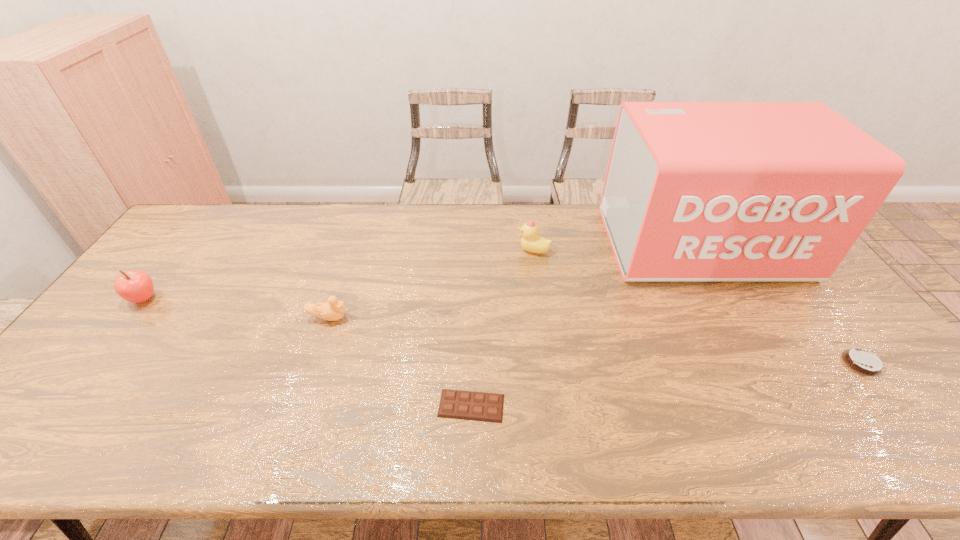
Locate an element on the screen. Image resolution: width=960 pixels, height=540 pixels. free space at the far left corner of the desktop is located at coordinates (196, 227).

The height and width of the screenshot is (540, 960). Identify the location of free space between the right duckling and the fourth nearest object. (339, 275).

Where is `free area in between the third object from left to right and the farther duckling`? This screenshot has height=540, width=960. free area in between the third object from left to right and the farther duckling is located at coordinates (502, 328).

This screenshot has height=540, width=960. I want to click on free spot between the box and the nearest object, so click(586, 325).

Image resolution: width=960 pixels, height=540 pixels. Identify the location of unoccupied position between the fourth nearest object and the chocolate cake. (503, 331).

Find the location of `free space that is in between the tallest object and the shortest object`. free space that is in between the tallest object and the shortest object is located at coordinates (586, 325).

The width and height of the screenshot is (960, 540). I want to click on empty location between the shortest object and the left duckling, so click(399, 362).

You are a GUI agent. You are given a task and a screenshot of the screen. Output one action in this format:
    pyautogui.click(x=<x>, y=<y>)
    Task: Click on the empty space that is in between the fifth farthest object and the third object from right to left
    The height and width of the screenshot is (540, 960).
    Given the screenshot: What is the action you would take?
    pyautogui.click(x=698, y=307)

Find the location of a particular element. This screenshot has width=960, height=540. vacant area that lies between the right duckling and the apple is located at coordinates click(339, 275).

Where is `free space between the fifth tallest object and the nearer duckling`? Image resolution: width=960 pixels, height=540 pixels. free space between the fifth tallest object and the nearer duckling is located at coordinates (595, 341).